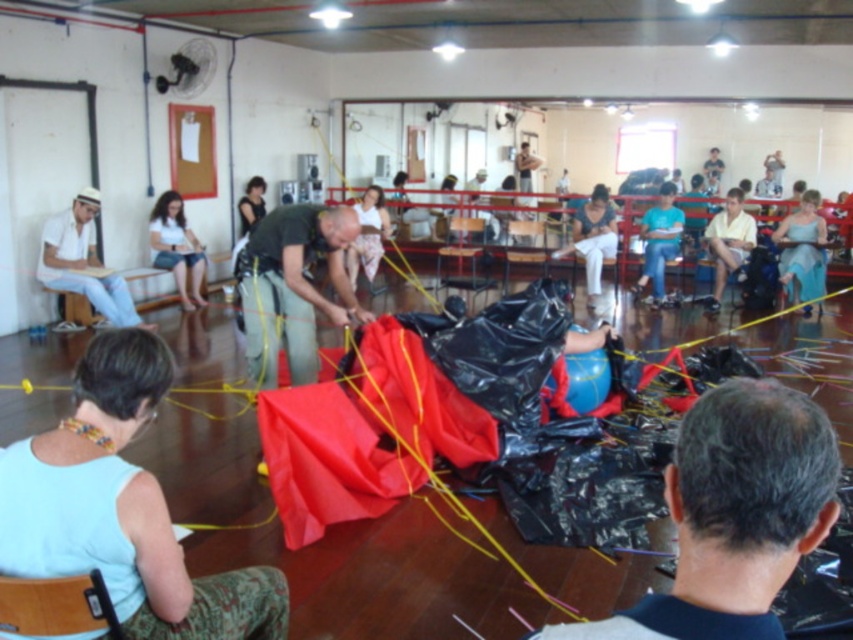
You are standing in the center of the room and want to find the white matte shirt at left. In which direction should you look to see it?

The white matte shirt at left is located at point (83, 262), so you should look to your left since it is positioned on the left side of the scene.